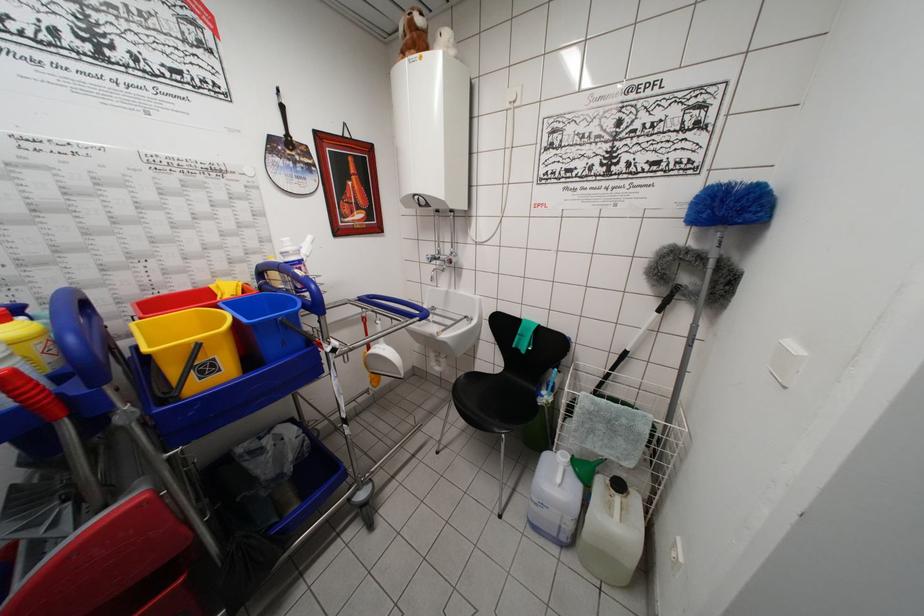
The width and height of the screenshot is (924, 616). What do you see at coordinates (627, 429) in the screenshot?
I see `a white wire basket` at bounding box center [627, 429].